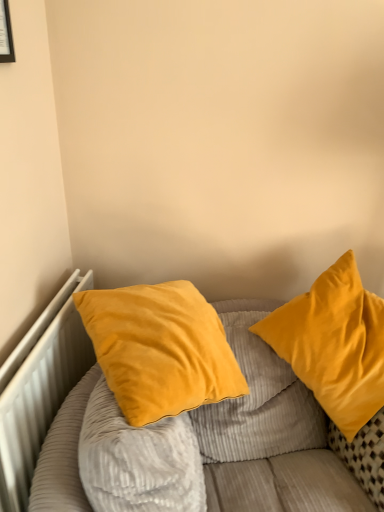
Question: Is matte black picture frame at upper left in front of or behind velvet yellow pillows at upper right in the image?

Choices:
 (A) front
 (B) behind

Answer: (B)

Question: Do you think matte black picture frame at upper left is within velvet yellow pillows at upper right, or outside of it?

Choices:
 (A) outside
 (B) inside

Answer: (A)

Question: Which of these objects is positioned farthest from the white metallic radiator at left?

Choices:
 (A) matte black picture frame at upper left
 (B) velvet yellow pillow at right, which appears as the first pillow when viewed from the right
 (C) velvet yellow pillows at upper right
 (D) velvet yellow pillow at center, the 1th pillow in the left-to-right sequence

Answer: (A)

Question: Which of these objects is positioned farthest from the velvet yellow pillows at upper right?

Choices:
 (A) white metallic radiator at left
 (B) velvet yellow pillow at center, which appears as the second pillow when viewed from the right
 (C) matte black picture frame at upper left
 (D) velvet yellow pillow at right, the 2th pillow positioned from the left

Answer: (C)